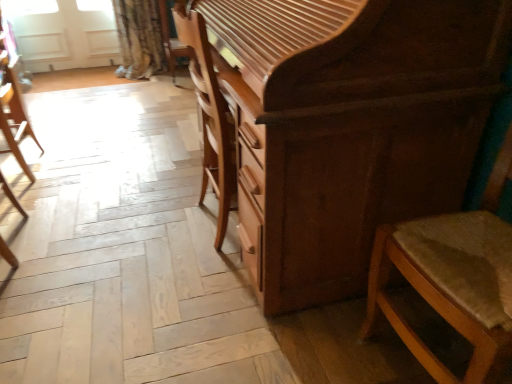
Question: Is wooden textured chair at right, which is counted as the 1th chair, starting from the right, situated inside white matte screen door at upper left or outside?

Choices:
 (A) outside
 (B) inside

Answer: (A)

Question: Considering the positions of wooden textured chair at right, which is counted as the 1th chair, starting from the right, and white matte screen door at upper left in the image, is wooden textured chair at right, which is counted as the 1th chair, starting from the right, bigger or smaller than white matte screen door at upper left?

Choices:
 (A) small
 (B) big

Answer: (B)

Question: Which is farther from the shiny brown chest of drawers at center?

Choices:
 (A) wooden chair at left, which is counted as the 1th chair, starting from the left
 (B) wooden textured chair at right, which is counted as the 1th chair, starting from the right
 (C) white matte screen door at upper left

Answer: (C)

Question: Estimate the real-world distances between objects in this image. Which object is farther from the wooden textured chair at right, marked as the 2th chair in a back-to-front arrangement?

Choices:
 (A) shiny brown chest of drawers at center
 (B) white matte screen door at upper left
 (C) wooden chair at left, the 2th chair in the right-to-left sequence

Answer: (B)